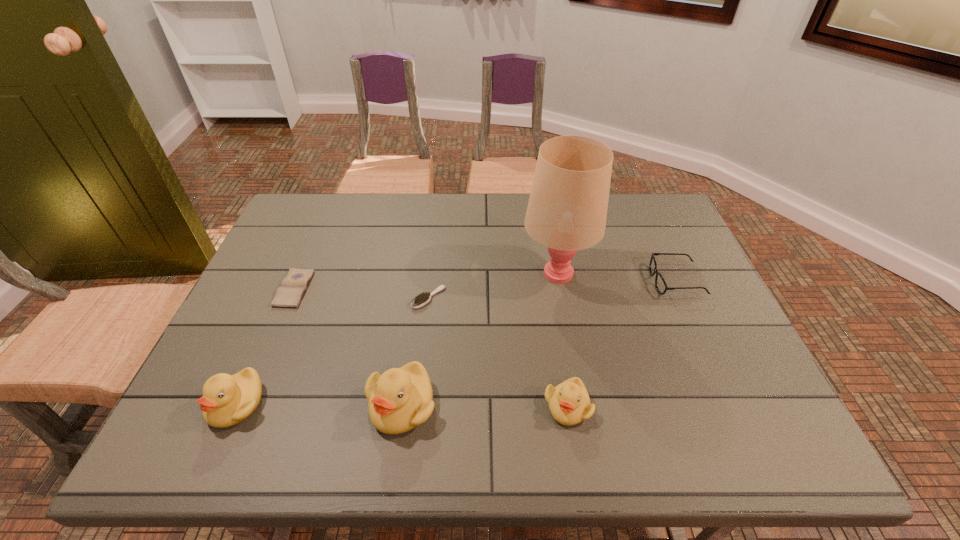
The height and width of the screenshot is (540, 960). I want to click on free space between the second shortest duckling and the tallest object, so click(396, 339).

Locate an element on the screen. This screenshot has height=540, width=960. unoccupied area between the tallest object and the tallest duckling is located at coordinates (479, 339).

You are a GUI agent. You are given a task and a screenshot of the screen. Output one action in this format:
    pyautogui.click(x=<x>, y=<y>)
    Task: Click on the unoccupied position between the tallest duckling and the rightmost object
    The width and height of the screenshot is (960, 540).
    Given the screenshot: What is the action you would take?
    pyautogui.click(x=539, y=343)

I want to click on free space between the scrubbing brush and the diary, so click(361, 294).

Where is `free spot between the tallest duckling and the shortest duckling`? The width and height of the screenshot is (960, 540). free spot between the tallest duckling and the shortest duckling is located at coordinates (485, 406).

Identify which object is the fourth nearest to the rightmost object. Please provide its 2D coordinates. Your answer should be formatted as a tuple, i.e. [(x, y)], where the tuple contains the x and y coordinates of a point satisfying the conditions above.

[(400, 399)]

At what (x,y) coordinates should I click in order to perform the action: click on object that stands as the third closest to the shortest duckling. Please return your answer as a coordinate pair (x, y). Image resolution: width=960 pixels, height=540 pixels. Looking at the image, I should click on (419, 301).

Point out which duckling is positioned as the second nearest to the shortest duckling. Please provide its 2D coordinates. Your answer should be formatted as a tuple, i.e. [(x, y)], where the tuple contains the x and y coordinates of a point satisfying the conditions above.

[(227, 400)]

Locate which duckling ranks in proximity to the leftmost duckling. Please provide its 2D coordinates. Your answer should be formatted as a tuple, i.e. [(x, y)], where the tuple contains the x and y coordinates of a point satisfying the conditions above.

[(400, 399)]

Where is `vacant area that satisfies the following two spatial constraints: 1. on the front side of the scrubbing brush; 2. on the right side of the shortest object`? The height and width of the screenshot is (540, 960). vacant area that satisfies the following two spatial constraints: 1. on the front side of the scrubbing brush; 2. on the right side of the shortest object is located at coordinates (291, 298).